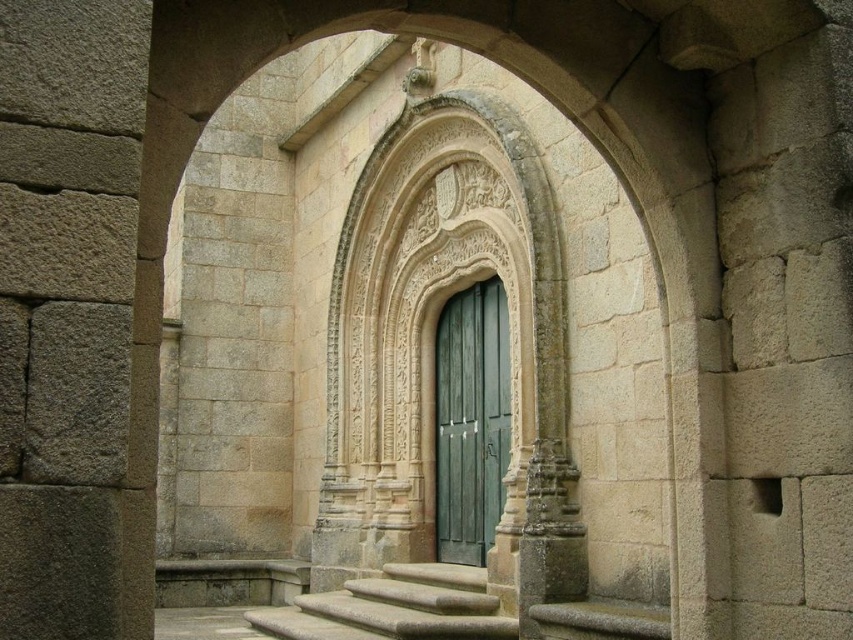
Question: Observing the image, what is the correct spatial positioning of green wooden door at center in reference to smooth gray stone stairs at center?

Choices:
 (A) above
 (B) below

Answer: (A)

Question: Can you confirm if green wooden door at center is bigger than smooth gray stone stairs at center?

Choices:
 (A) no
 (B) yes

Answer: (A)

Question: Which point is farther to the camera?

Choices:
 (A) smooth gray stone stairs at center
 (B) green wooden door at center

Answer: (B)

Question: From the image, what is the correct spatial relationship of green wooden door at center in relation to smooth gray stone stairs at center?

Choices:
 (A) right
 (B) left

Answer: (A)